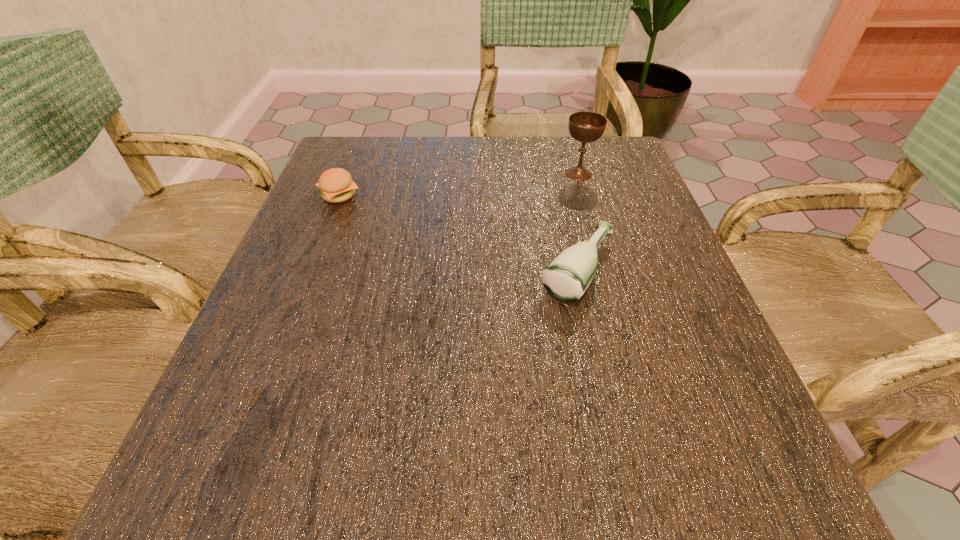
This screenshot has height=540, width=960. What are the coordinates of `free space between the shortest object and the nearest object` in the screenshot? It's located at point(458,233).

Locate an element on the screen. The image size is (960, 540). object that stands as the closest to the tallest object is located at coordinates (566, 278).

Identify which object is the closest to the leftmost object. Please provide its 2D coordinates. Your answer should be formatted as a tuple, i.e. [(x, y)], where the tuple contains the x and y coordinates of a point satisfying the conditions above.

[(566, 278)]

This screenshot has width=960, height=540. I want to click on vacant region that satisfies the following two spatial constraints: 1. on the back side of the nearest object; 2. on the left side of the tallest object, so click(x=556, y=174).

Locate an element on the screen. vacant region that satisfies the following two spatial constraints: 1. on the front side of the bottle; 2. on the right side of the hamburger is located at coordinates (309, 271).